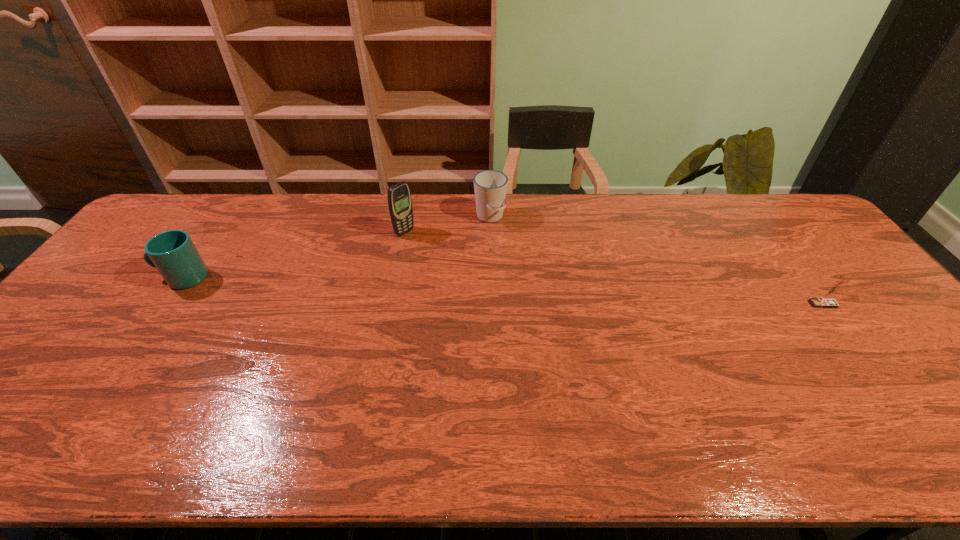
At what (x,y) coordinates should I click in order to perform the action: click on free point at the far edge. Please return your answer as a coordinate pair (x, y). The height and width of the screenshot is (540, 960). Looking at the image, I should click on (692, 194).

Identify the location of vacant space at the near edge. (764, 403).

In order to click on free spot at the right edge of the desktop in this screenshot , I will do `click(921, 350)`.

In the image, there is a desktop. Identify the location of free space at the far left corner. (170, 204).

Identify the location of vacant area that lies between the left cup and the nearest object. (502, 291).

At what (x,y) coordinates should I click in order to perform the action: click on free space that is in between the cellular telephone and the nearest object. Please return your answer as a coordinate pair (x, y). This screenshot has width=960, height=540. Looking at the image, I should click on (613, 268).

I want to click on free spot between the second nearest object and the right cup, so click(336, 247).

Locate an element on the screen. free space between the farther cup and the rightmost object is located at coordinates (656, 260).

The height and width of the screenshot is (540, 960). I want to click on free space between the third object from right to left and the rightmost object, so click(613, 268).

Find the location of a particular element. Image resolution: width=960 pixels, height=540 pixels. vacant point located between the cellular telephone and the nearest object is located at coordinates (613, 268).